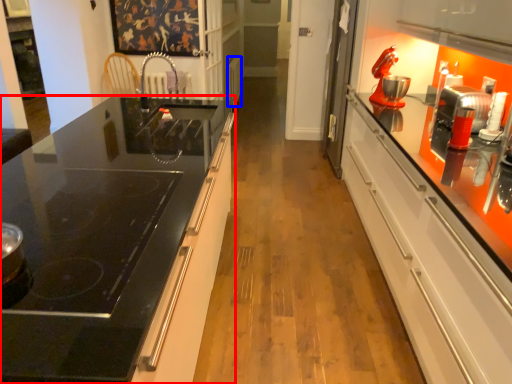
Question: Among these objects, which one is farthest to the camera, countertop (highlighted by a red box) or appliance (highlighted by a blue box)?

Choices:
 (A) countertop
 (B) appliance

Answer: (B)